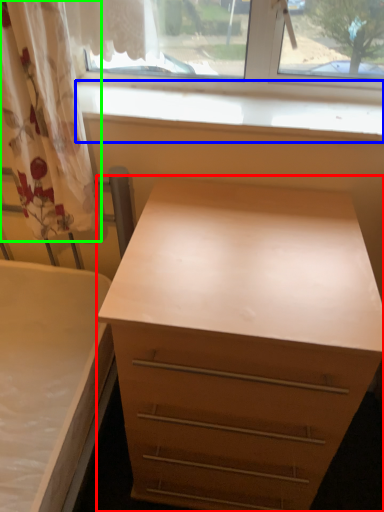
Question: Which is farther away from chest of drawers (highlighted by a red box)? window sill (highlighted by a blue box) or curtain (highlighted by a green box)?

Choices:
 (A) window sill
 (B) curtain

Answer: (A)